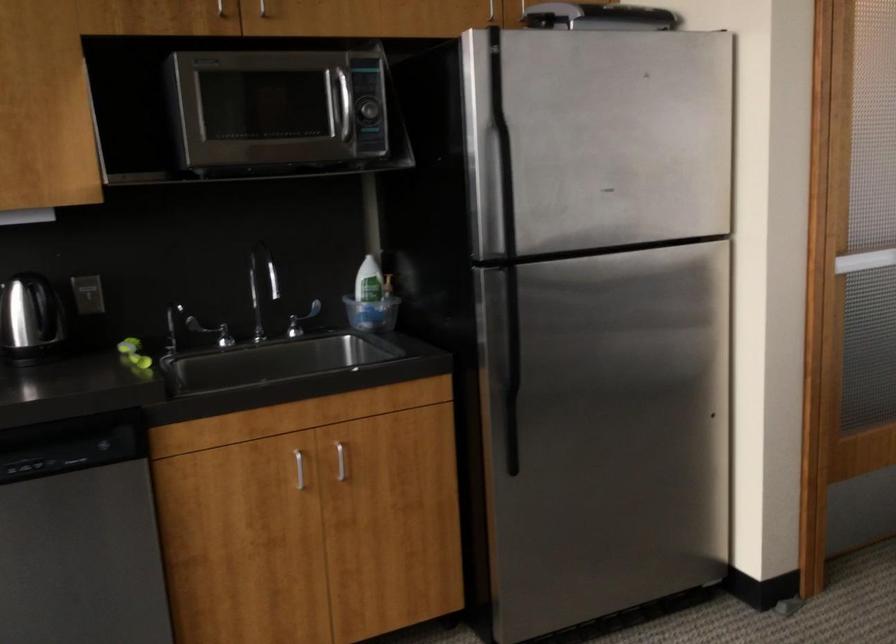
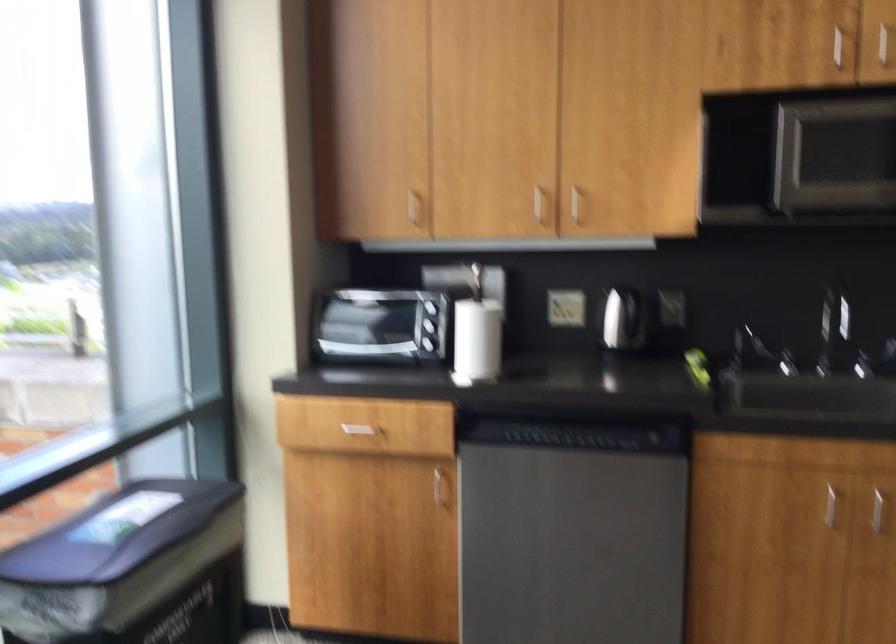
Question: The images are taken continuously from a first-person perspective. In which direction is your viewpoint rotating?

Choices:
 (A) Left
 (B) Right
 (C) Up
 (D) Down

Answer: (A)